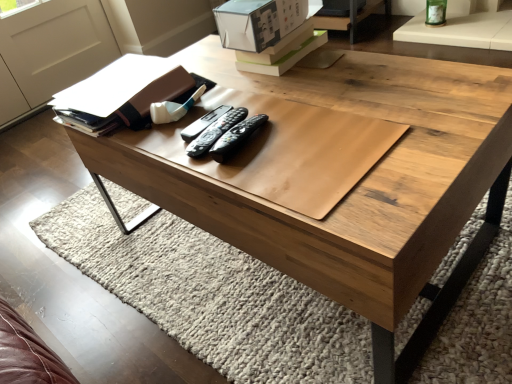
Question: Should I look upward or downward to see black plastic remote at center, the 3th remote when ordered from left to right?

Choices:
 (A) up
 (B) down

Answer: (A)

Question: Is white cardboard box at upper center placed right next to black plastic remote at center, marked as the 1th remote in a left-to-right arrangement?

Choices:
 (A) yes
 (B) no

Answer: (B)

Question: From a real-world perspective, is white cardboard box at upper center located higher than black plastic remote at center, which ranks as the third remote in right-to-left order?

Choices:
 (A) yes
 (B) no

Answer: (A)

Question: Does white cardboard box at upper center have a smaller size compared to black plastic remote at center, which ranks as the third remote in right-to-left order?

Choices:
 (A) yes
 (B) no

Answer: (B)

Question: Does white cardboard box at upper center contain black plastic remote at center, which ranks as the third remote in right-to-left order?

Choices:
 (A) yes
 (B) no

Answer: (B)

Question: Considering the relative positions of white cardboard box at upper center and black plastic remote at center, which ranks as the third remote in right-to-left order, in the image provided, is white cardboard box at upper center behind black plastic remote at center, which ranks as the third remote in right-to-left order,?

Choices:
 (A) yes
 (B) no

Answer: (A)

Question: Can you confirm if white cardboard box at upper center is shorter than black plastic remote at center, which ranks as the third remote in right-to-left order?

Choices:
 (A) no
 (B) yes

Answer: (A)

Question: Is black plastic remote at center, acting as the 1th remote starting from the right, shorter than black plastic remote at center, marked as the 2th remote in a right-to-left arrangement?

Choices:
 (A) no
 (B) yes

Answer: (A)

Question: Is black plastic remote at center, which ranks as the 2th remote in left-to-right order, inside black plastic remote at center, acting as the 1th remote starting from the right?

Choices:
 (A) yes
 (B) no

Answer: (B)

Question: Does black plastic remote at center, the 3th remote when ordered from left to right, come in front of black plastic remote at center, marked as the 2th remote in a right-to-left arrangement?

Choices:
 (A) no
 (B) yes

Answer: (B)

Question: From a real-world perspective, does black plastic remote at center, the 3th remote when ordered from left to right, sit lower than black plastic remote at center, which ranks as the 2th remote in left-to-right order?

Choices:
 (A) yes
 (B) no

Answer: (B)

Question: Is black plastic remote at center, acting as the 1th remote starting from the right, oriented towards black plastic remote at center, which ranks as the 2th remote in left-to-right order?

Choices:
 (A) no
 (B) yes

Answer: (A)

Question: From a real-world perspective, is black plastic remote at center, acting as the 1th remote starting from the right, on top of black plastic remote at center, which ranks as the 2th remote in left-to-right order?

Choices:
 (A) yes
 (B) no

Answer: (A)

Question: Is white cardboard box at upper center turned away from black plastic remote at center, the 3th remote when ordered from left to right?

Choices:
 (A) no
 (B) yes

Answer: (A)